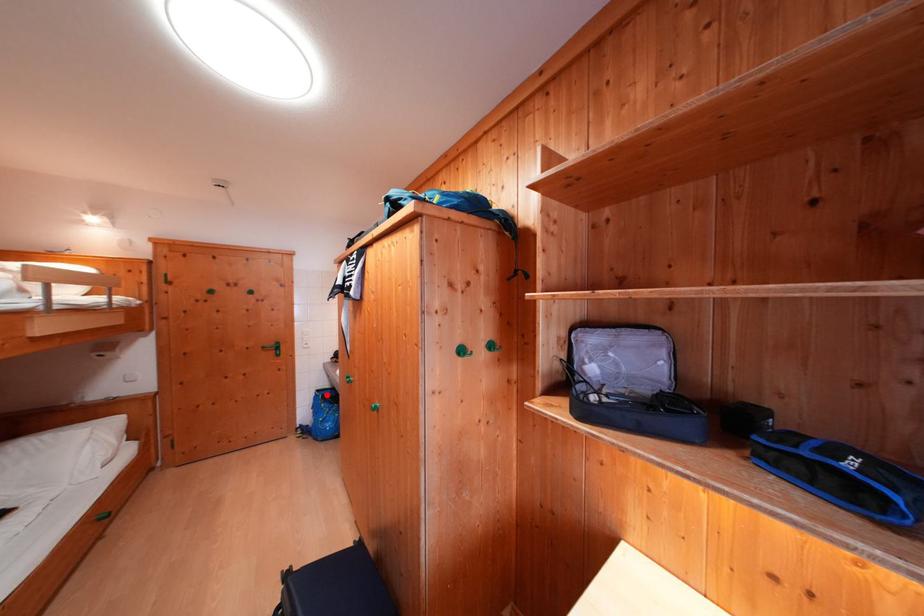
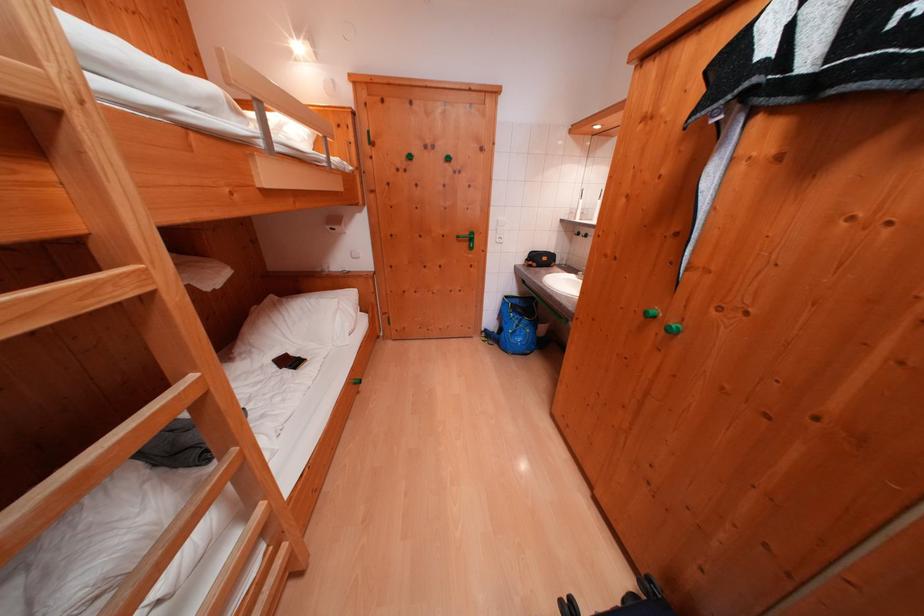
Question: I am providing you with two images of the same scene from different viewpoints. A red point is shown in image1. For the corresponding object point in image2, is it positioned nearer or farther from the camera?

Choices:
 (A) Nearer
 (B) Farther

Answer: (A)